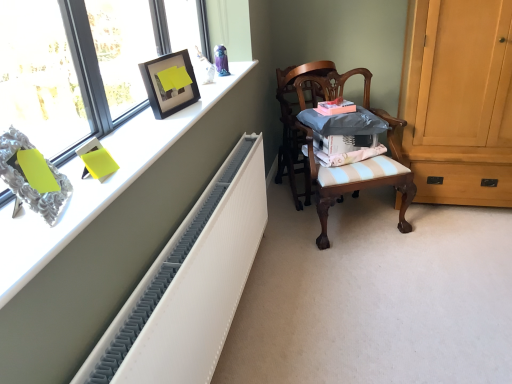
This screenshot has height=384, width=512. Find the location of `vacant space in front of light brown wood cabinet at right`. vacant space in front of light brown wood cabinet at right is located at coordinates (456, 251).